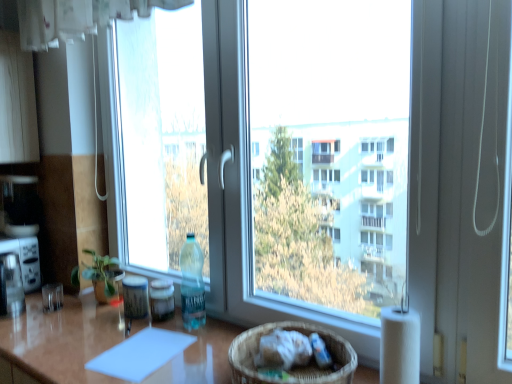
Question: Is white paper at right to the left of green matte plant at left from the viewer's perspective?

Choices:
 (A) no
 (B) yes

Answer: (A)

Question: From the image's perspective, is white paper at right above green matte plant at left?

Choices:
 (A) yes
 (B) no

Answer: (B)

Question: From the image's perspective, would you say white paper at right is shown under green matte plant at left?

Choices:
 (A) no
 (B) yes

Answer: (B)

Question: Does white paper at right have a lesser height compared to green matte plant at left?

Choices:
 (A) yes
 (B) no

Answer: (B)

Question: Can we say white paper at right lies outside green matte plant at left?

Choices:
 (A) yes
 (B) no

Answer: (A)

Question: Is white paper at right oriented away from green matte plant at left?

Choices:
 (A) yes
 (B) no

Answer: (B)

Question: Does shiny brown table at center have a lesser height compared to transparent glass window at center?

Choices:
 (A) no
 (B) yes

Answer: (B)

Question: Would you consider shiny brown table at center to be distant from transparent glass window at center?

Choices:
 (A) no
 (B) yes

Answer: (B)

Question: Is shiny brown table at center oriented away from transparent glass window at center?

Choices:
 (A) yes
 (B) no

Answer: (B)

Question: Is shiny brown table at center located outside transparent glass window at center?

Choices:
 (A) no
 (B) yes

Answer: (B)

Question: From a real-world perspective, is shiny brown table at center over transparent glass window at center?

Choices:
 (A) yes
 (B) no

Answer: (B)

Question: Considering the relative sizes of shiny brown table at center and transparent glass window at center in the image provided, is shiny brown table at center bigger than transparent glass window at center?

Choices:
 (A) no
 (B) yes

Answer: (B)

Question: From the image's perspective, is translucent plastic bottle at center beneath woven brown basket at lower center?

Choices:
 (A) no
 (B) yes

Answer: (A)